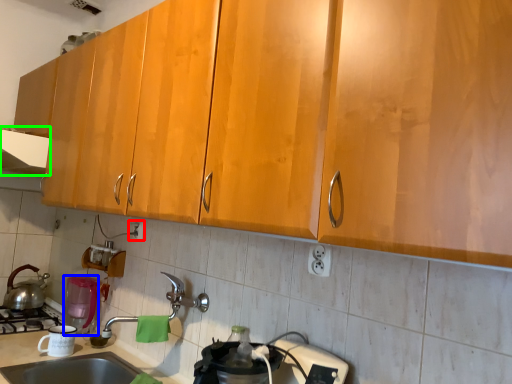
Question: Which object is positioned closest to electric outlet (highlighted by a red box)? Select from appliance (highlighted by a blue box) and exhaust hood (highlighted by a green box).

Choices:
 (A) appliance
 (B) exhaust hood

Answer: (A)